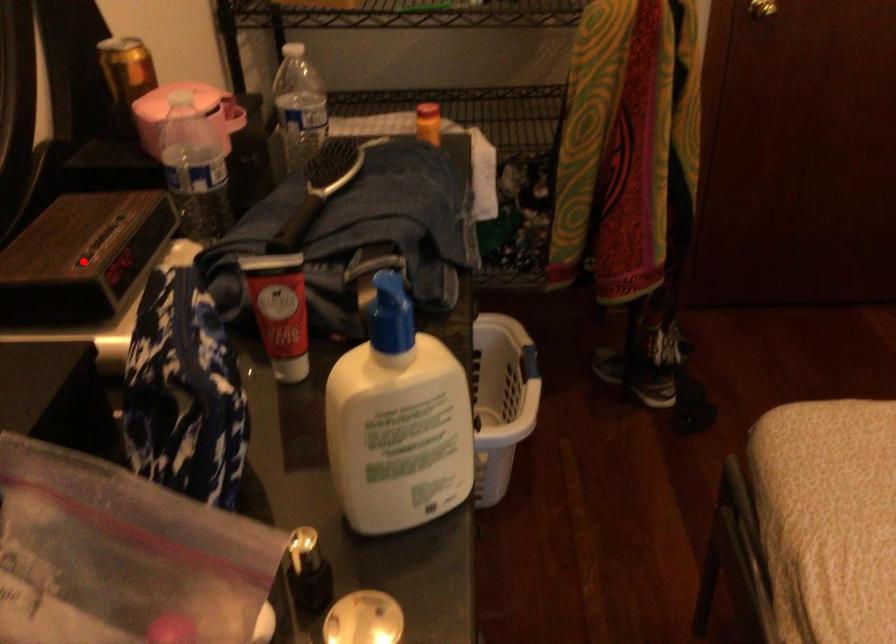
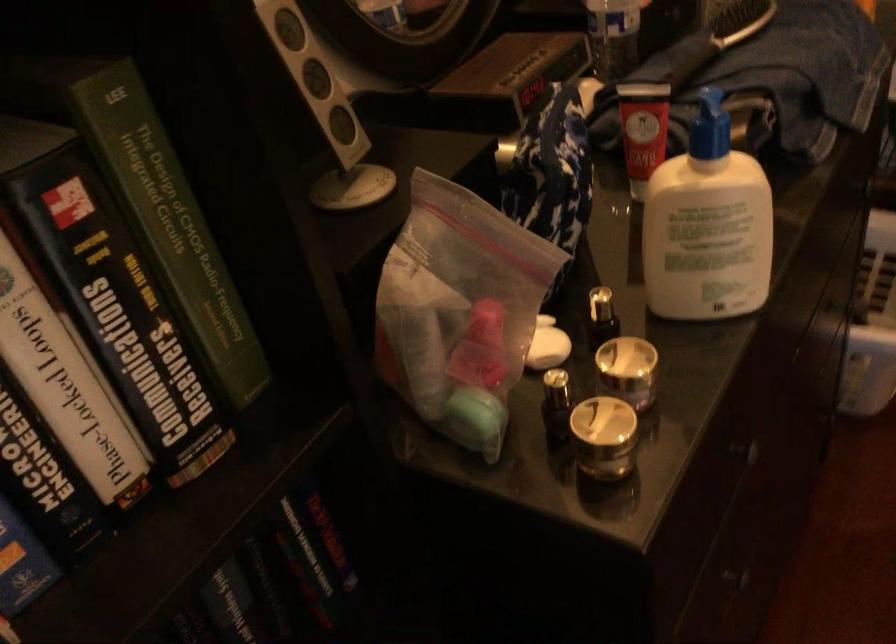
Find the pixel in the second image that matches the highlighted location in the first image.

(506, 80)